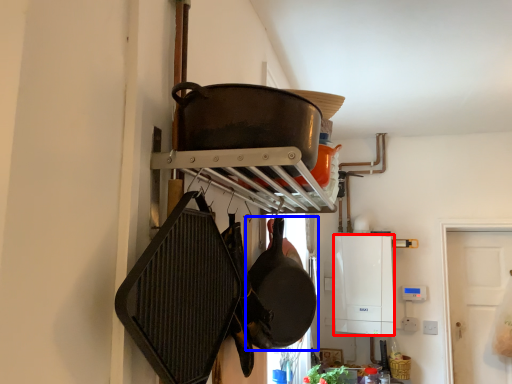
Question: Which object appears farthest to the camera in this image, appliance (highlighted by a red box) or frying pan (highlighted by a blue box)?

Choices:
 (A) appliance
 (B) frying pan

Answer: (A)